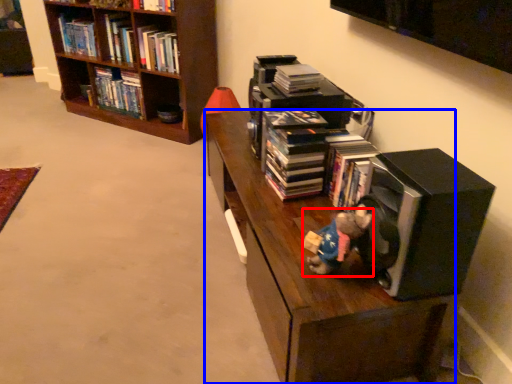
Question: Which of the following is the closest to the observer, figurine (highlighted by a red box) or shelf (highlighted by a blue box)?

Choices:
 (A) figurine
 (B) shelf

Answer: (A)